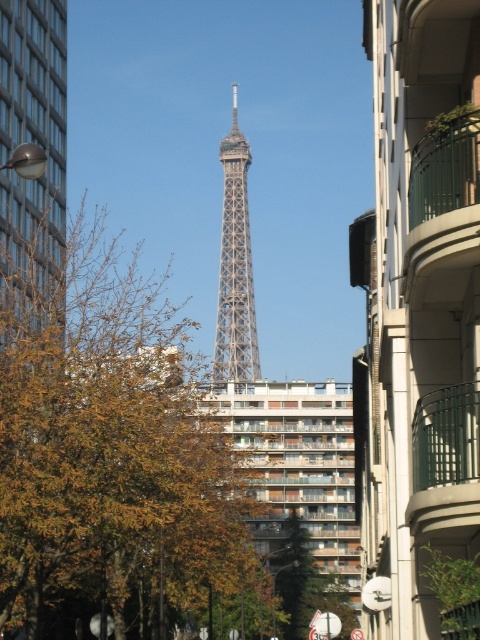
Is point (144, 298) positioned after point (225, 348)?

That is False.

Who is positioned more to the left, brown leafy tree at center or metallic lattice tower at center?

brown leafy tree at center

Identify the location of brown leafy tree at center. [x=112, y=460].

Is metallic streetlight at left to the right of metallic lattice tower at center from the viewer's perspective?

In fact, metallic streetlight at left is to the left of metallic lattice tower at center.

Consider the image. Does metallic streetlight at left have a smaller size compared to metallic lattice tower at center?

Correct, metallic streetlight at left occupies less space than metallic lattice tower at center.

Which is behind, point (16, 83) or point (251, 285)?

The point (251, 285) is more distant.

Where is `metallic streetlight at left`? This screenshot has width=480, height=640. metallic streetlight at left is located at coordinates (33, 134).

In the scene shown: Is brown leafy tree at center positioned behind metallic streetlight at left?

Yes.

Can you confirm if brown leafy tree at center is positioned to the left of metallic streetlight at left?

In fact, brown leafy tree at center is to the right of metallic streetlight at left.

Is point (84, 616) farther from viewer compared to point (12, 42)?

That is False.

In order to click on brown leafy tree at center in this screenshot , I will do [x=112, y=460].